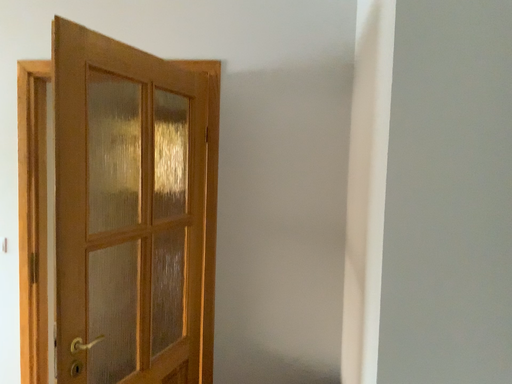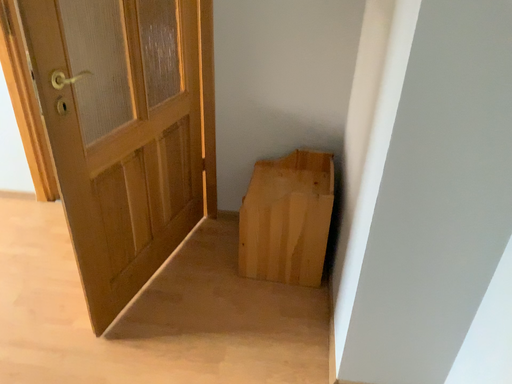
Question: How did the camera likely rotate when shooting the video?

Choices:
 (A) rotated downward
 (B) rotated upward

Answer: (A)